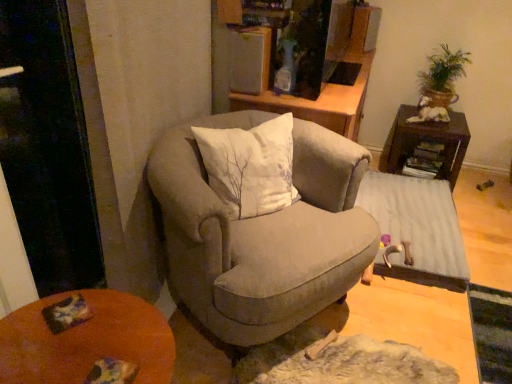
Question: From the image's perspective, is green leafy plant at upper right positioned above or below orange wooden desk at lower left?

Choices:
 (A) below
 (B) above

Answer: (B)

Question: Considering the positions of green leafy plant at upper right and orange wooden desk at lower left in the image, is green leafy plant at upper right bigger or smaller than orange wooden desk at lower left?

Choices:
 (A) small
 (B) big

Answer: (A)

Question: Estimate the real-world distances between objects in this image. Which object is closer to the green leafy plant at upper right?

Choices:
 (A) white ceramic dog at upper right
 (B) velvet beige armchair at center
 (C) wooden textured table at lower right, marked as the 2th table in a top-to-bottom arrangement
 (D) orange wooden desk at lower left
 (E) dark brown wood side table at right, the second table in the bottom-to-top sequence

Answer: (A)

Question: Which is farther from the velvet beige armchair at center?

Choices:
 (A) wooden textured table at lower right, marked as the 2th table in a top-to-bottom arrangement
 (B) orange wooden desk at lower left
 (C) green leafy plant at upper right
 (D) white ceramic dog at upper right
 (E) dark brown wood side table at right, the second table in the bottom-to-top sequence

Answer: (C)